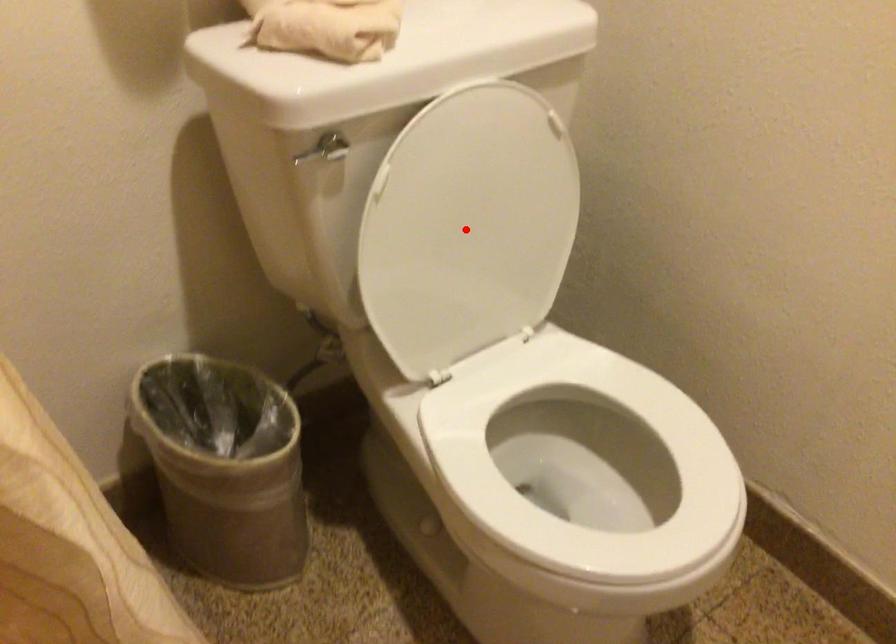
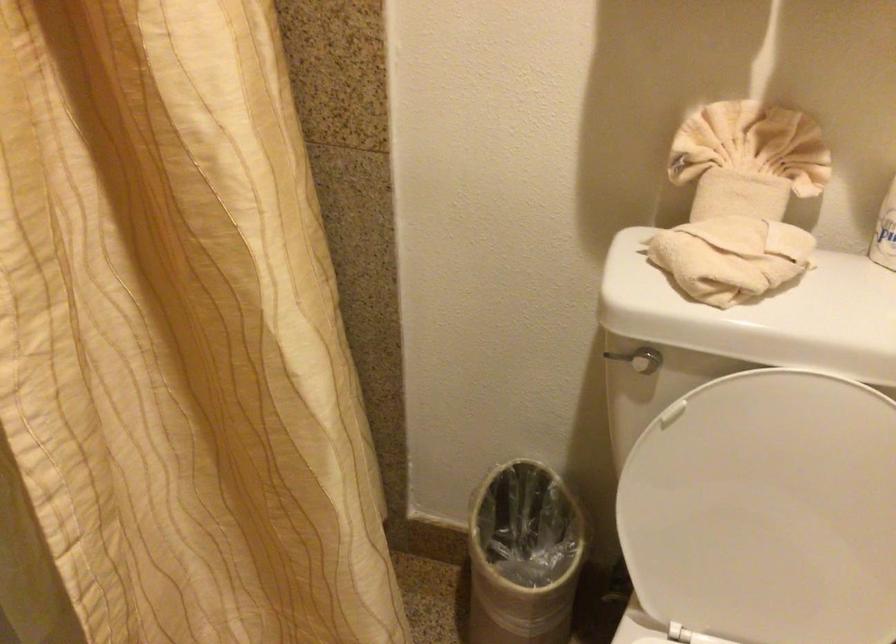
Question: I am providing you with two images of the same scene from different viewpoints. In image1, a red point is highlighted. Considering the same 3D point in image2, which of the following is correct?

Choices:
 (A) It is closer
 (B) It is farther

Answer: (A)